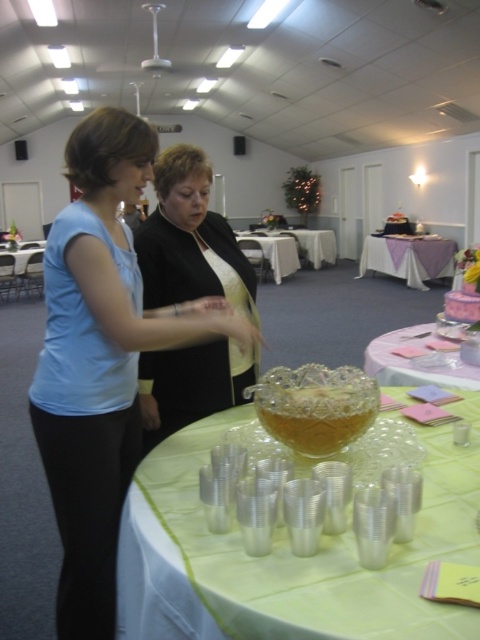
Is point (128, 164) positioned before point (29, 284)?

Yes, it is.

Is point (130, 260) more distant than point (21, 260)?

That is False.

Identify the location of matte blue shirt at left. Image resolution: width=480 pixels, height=640 pixels. (101, 358).

Where is `matte blue shirt at left`? The height and width of the screenshot is (640, 480). matte blue shirt at left is located at coordinates (101, 358).

Is translucent glass punch bowl at center closer to camera compared to white tablecloth at center?

Yes, it is.

Between translucent glass punch bowl at center and white tablecloth at center, which one has more height?

Standing taller between the two is white tablecloth at center.

What do you see at coordinates (315, 406) in the screenshot?
I see `translucent glass punch bowl at center` at bounding box center [315, 406].

Where is `translucent glass punch bowl at center`? Image resolution: width=480 pixels, height=640 pixels. translucent glass punch bowl at center is located at coordinates (315, 406).

Looking at this image, between white tablecloth at center and green fabric table at center, which one has less height?

With less height is white tablecloth at center.

Who is positioned more to the left, white tablecloth at center or green fabric table at center?

Positioned to the left is green fabric table at center.

The width and height of the screenshot is (480, 640). I want to click on white tablecloth at center, so click(313, 248).